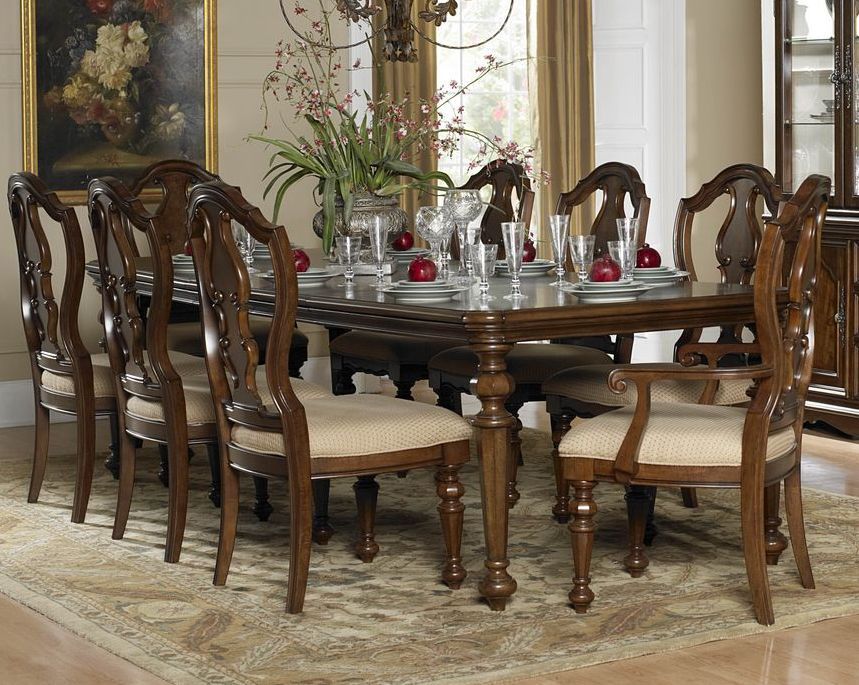
Find the location of a particular element. The image size is (859, 685). dining room chairs is located at coordinates (x=28, y=271), (x=131, y=266), (x=222, y=279), (x=771, y=345), (x=741, y=224), (x=594, y=203), (x=515, y=195), (x=163, y=186).